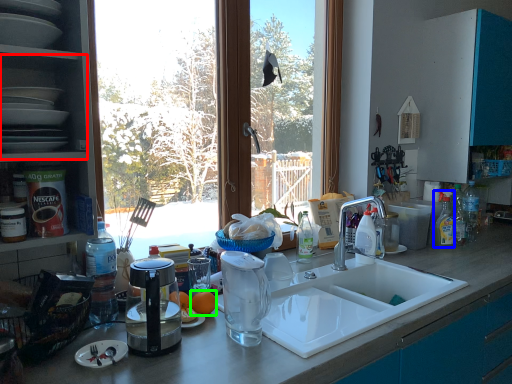
Question: Which object is the closest to the shelf (highlighted by a red box)? Choose among these: cleaning product (highlighted by a blue box) or orange (highlighted by a green box).

Choices:
 (A) cleaning product
 (B) orange

Answer: (B)